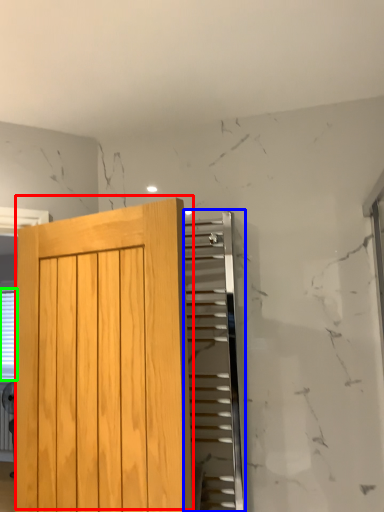
Question: Which is nearer to the door (highlighted by a red box)? elevator (highlighted by a blue box) or blind (highlighted by a green box).

Choices:
 (A) elevator
 (B) blind

Answer: (B)